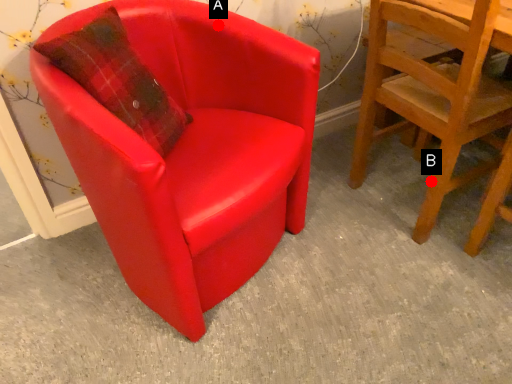
Question: Two points are circled on the image, labeled by A and B beside each circle. Which point is farther to the camera?

Choices:
 (A) A is further
 (B) B is further

Answer: (B)